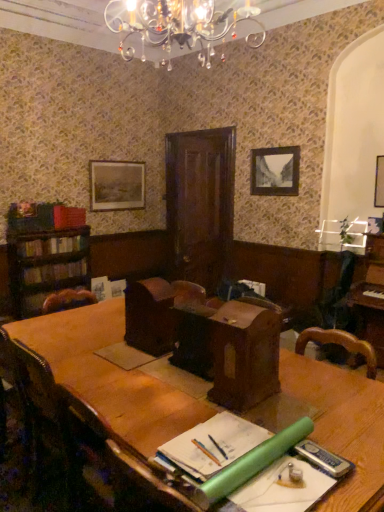
Question: From the image's perspective, is matte red bookshelf at left, placed as the 3th book when sorted from bottom to top, below hardcover books at left, the second book from the top?

Choices:
 (A) no
 (B) yes

Answer: (A)

Question: Can you confirm if matte red bookshelf at left, which is counted as the first book, starting from the top, is shorter than hardcover books at left, the second book from the top?

Choices:
 (A) yes
 (B) no

Answer: (B)

Question: From the image's perspective, is matte red bookshelf at left, placed as the 3th book when sorted from bottom to top, on hardcover books at left, which is the second book in bottom-to-top order?

Choices:
 (A) yes
 (B) no

Answer: (A)

Question: Does matte red bookshelf at left, placed as the 3th book when sorted from bottom to top, turn towards hardcover books at left, the second book from the top?

Choices:
 (A) yes
 (B) no

Answer: (B)

Question: Does matte red bookshelf at left, placed as the 3th book when sorted from bottom to top, come in front of hardcover books at left, the second book from the top?

Choices:
 (A) no
 (B) yes

Answer: (A)

Question: From their relative heights in the image, would you say wooden desk at center is taller or shorter than brown leather armchair at center, the 2th armchair positioned from the right?

Choices:
 (A) short
 (B) tall

Answer: (B)

Question: Based on their positions, is wooden desk at center located to the left or right of brown leather armchair at center, the first armchair when ordered from left to right?

Choices:
 (A) left
 (B) right

Answer: (B)

Question: Do you think wooden desk at center is within brown leather armchair at center, the first armchair when ordered from left to right, or outside of it?

Choices:
 (A) outside
 (B) inside

Answer: (A)

Question: Is wooden desk at center wider or thinner than brown leather armchair at center, the first armchair when ordered from left to right?

Choices:
 (A) thin
 (B) wide

Answer: (B)

Question: Relative to wooden chair at lower left, is matte red bookshelf at left, placed as the 3th book when sorted from bottom to top, in front or behind?

Choices:
 (A) front
 (B) behind

Answer: (B)

Question: Would you say matte red bookshelf at left, which is counted as the first book, starting from the top, is to the left or to the right of wooden chair at lower left in the picture?

Choices:
 (A) right
 (B) left

Answer: (B)

Question: Is matte red bookshelf at left, which is counted as the first book, starting from the top, taller or shorter than wooden chair at lower left?

Choices:
 (A) short
 (B) tall

Answer: (A)

Question: Does point (84, 218) appear closer or farther from the camera than point (104, 508)?

Choices:
 (A) farther
 (B) closer

Answer: (A)

Question: Is wooden picture frame at upper right, the first picture frame in the right-to-left sequence, spatially inside wooden picture frame at upper center, the 2th picture frame when ordered from back to front, or outside of it?

Choices:
 (A) inside
 (B) outside

Answer: (B)

Question: Is point (379, 176) positioned closer to the camera than point (269, 181)?

Choices:
 (A) farther
 (B) closer

Answer: (B)